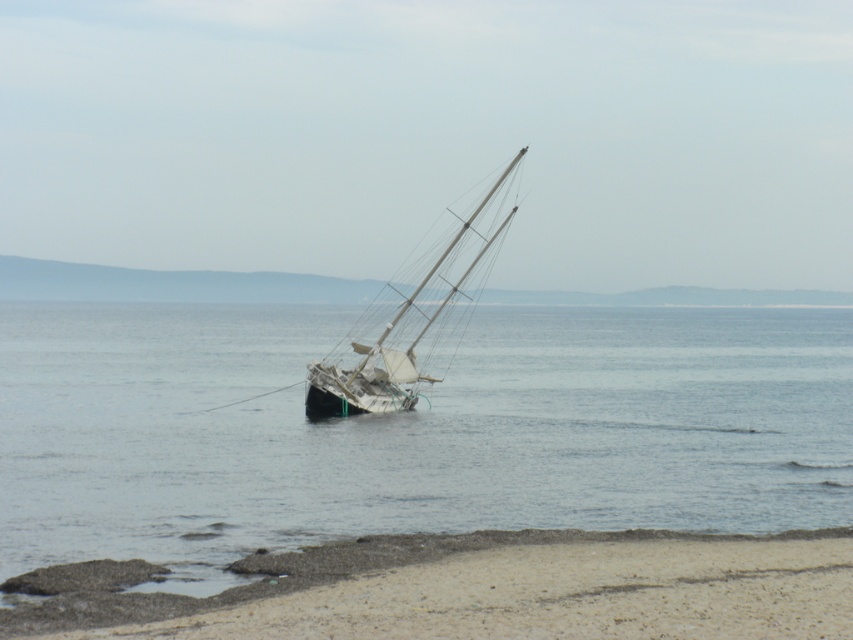
Question: Can you confirm if transparent water at center is wider than white matte sailboat at center?

Choices:
 (A) yes
 (B) no

Answer: (A)

Question: Can you confirm if transparent water at center is thinner than sandy beach at lower center?

Choices:
 (A) yes
 (B) no

Answer: (B)

Question: Which point appears farthest from the camera in this image?

Choices:
 (A) (134, 355)
 (B) (498, 580)

Answer: (A)

Question: Can you confirm if transparent water at center is bigger than sandy beach at lower center?

Choices:
 (A) yes
 (B) no

Answer: (A)

Question: Which point is closer to the camera?

Choices:
 (A) (250, 573)
 (B) (42, 563)

Answer: (A)

Question: Which object is closer to the camera taking this photo?

Choices:
 (A) transparent water at center
 (B) white matte sailboat at center
 (C) sandy beach at lower center

Answer: (C)